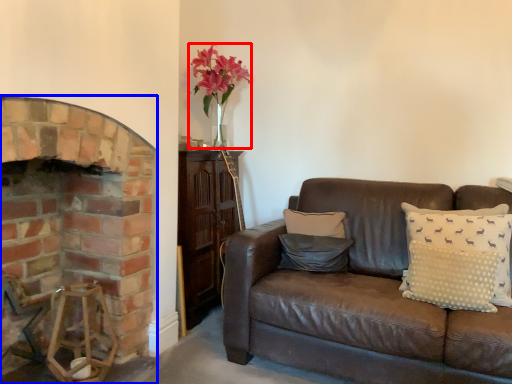
Question: Among these objects, which one is farthest to the camera, floral arrangement (highlighted by a red box) or fireplace (highlighted by a blue box)?

Choices:
 (A) floral arrangement
 (B) fireplace

Answer: (A)